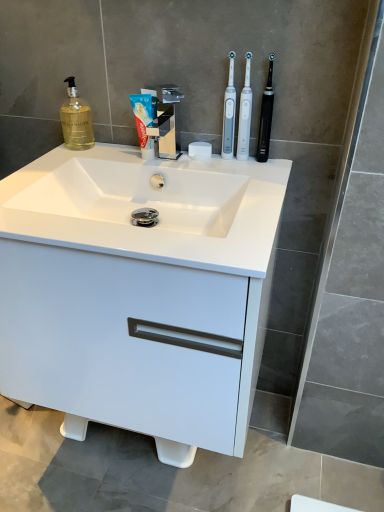
Locate an element on the screen. vacant space positioned to the left of polished chrome faucet at center is located at coordinates (103, 160).